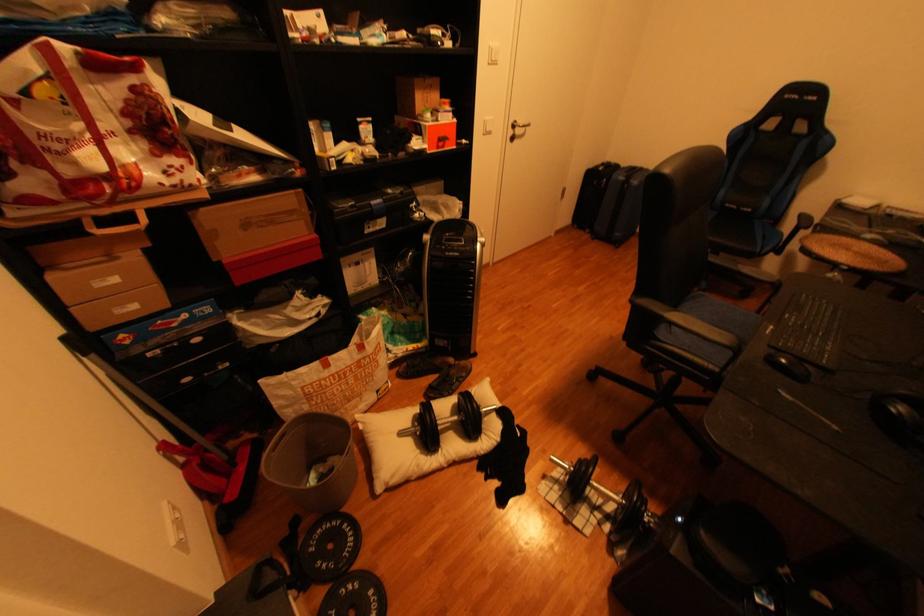
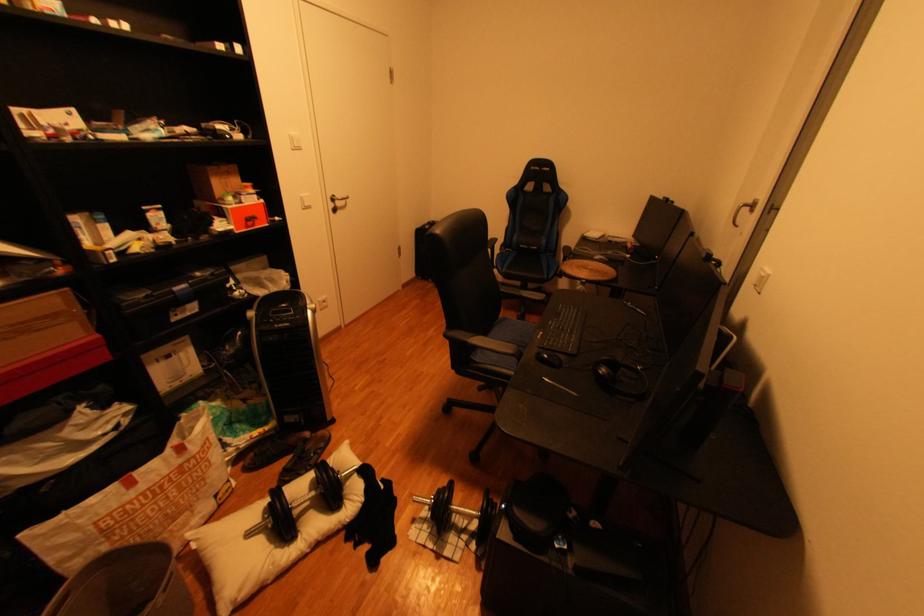
The point at (569, 496) is marked in the first image. Where is the corresponding point in the second image?

(440, 533)